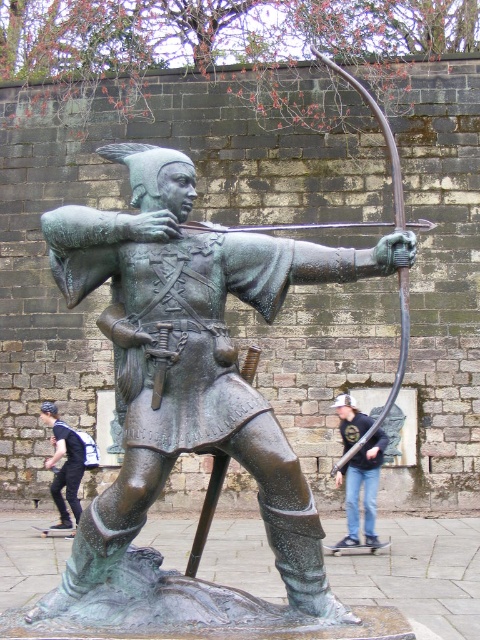
You are a visitor at a park and see the green patina bronze archer at center and the jeans at lower right. Which object is taller?

The green patina bronze archer at center is taller than the jeans at lower right.

You are a photographer setting up a shoot in front of the bronze statue. You notice two pairs of jeans placed on the ground near the statue. The jeans at lower right and dark blue jeans at lower left. Which pair of jeans should you avoid placing under the statue to ensure they are not in the main camera frame? Please choose based on their size.

You should avoid placing the jeans at lower right under the statue because it is larger in size compared to the dark blue jeans at lower left, making it more likely to be in the main camera frame.